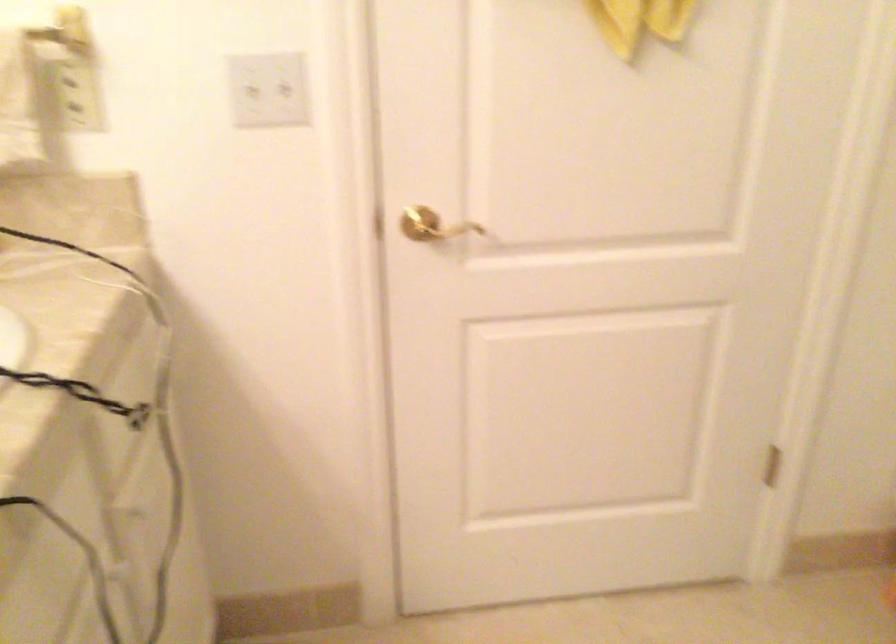
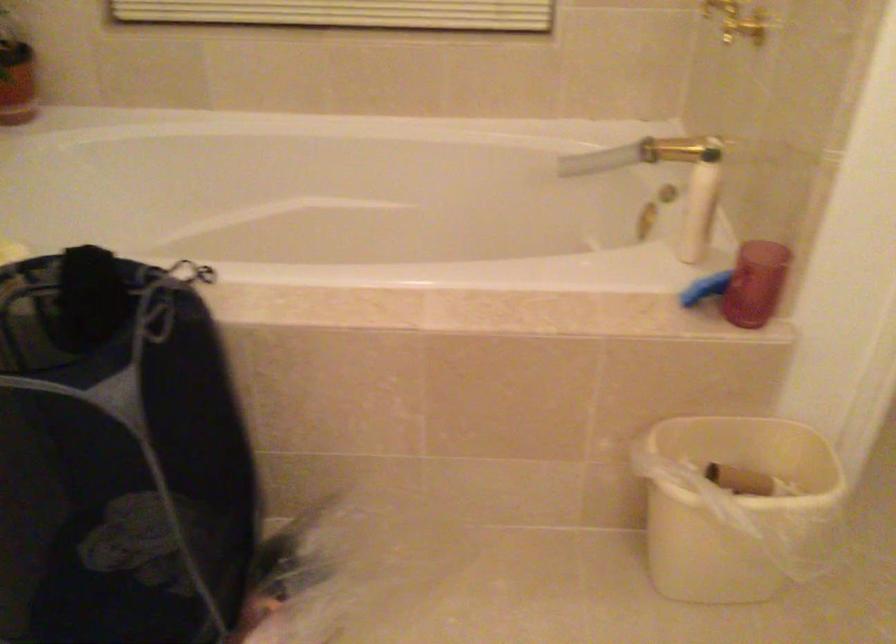
The images are taken continuously from a first-person perspective. In which direction is your viewpoint rotating?

The camera's rotation is toward right-down.